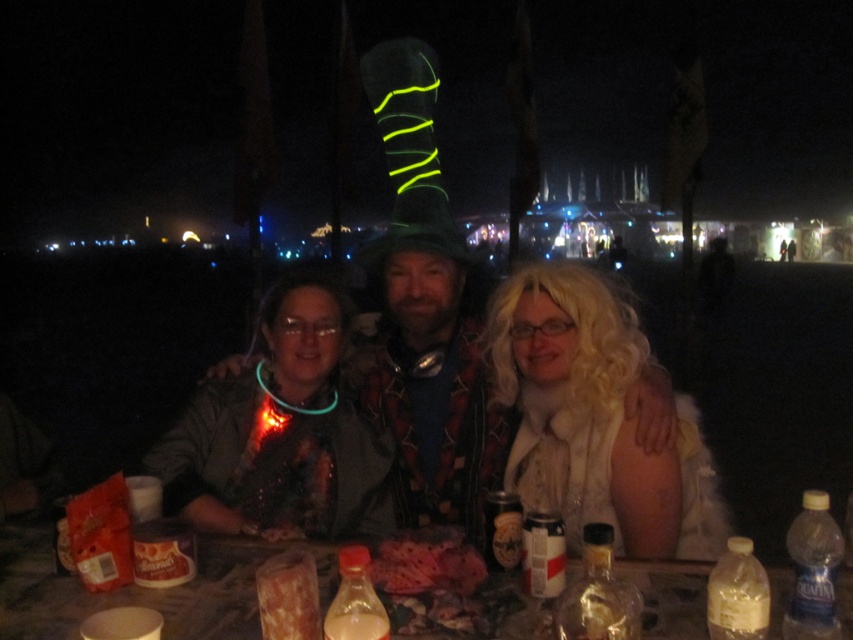
Can you confirm if white fluffy wig at center is bigger than clear plastic bottle at lower right?

Yes.

Is white fluffy wig at center above clear plastic bottle at lower right?

Indeed, white fluffy wig at center is positioned over clear plastic bottle at lower right.

This screenshot has height=640, width=853. In order to click on white fluffy wig at center in this screenshot , I will do `click(593, 419)`.

Which is behind, point (306, 412) or point (717, 602)?

The point (306, 412) is more distant.

Does point (287, 349) come closer to viewer compared to point (747, 614)?

No, (287, 349) is further to viewer.

Does point (328, 396) lie in front of point (757, 625)?

No, (328, 396) is further to viewer.

Where is `neon blue necklace at center`? neon blue necklace at center is located at coordinates (280, 433).

Can you confirm if translucent plastic bottle at lower right is shorter than metallic silver can at center?

No.

Can you confirm if translucent plastic bottle at lower right is thinner than metallic silver can at center?

No.

The width and height of the screenshot is (853, 640). What are the coordinates of `translucent plastic bottle at lower right` in the screenshot? It's located at (737, 593).

In order to click on translucent plastic bottle at lower right in this screenshot , I will do `click(737, 593)`.